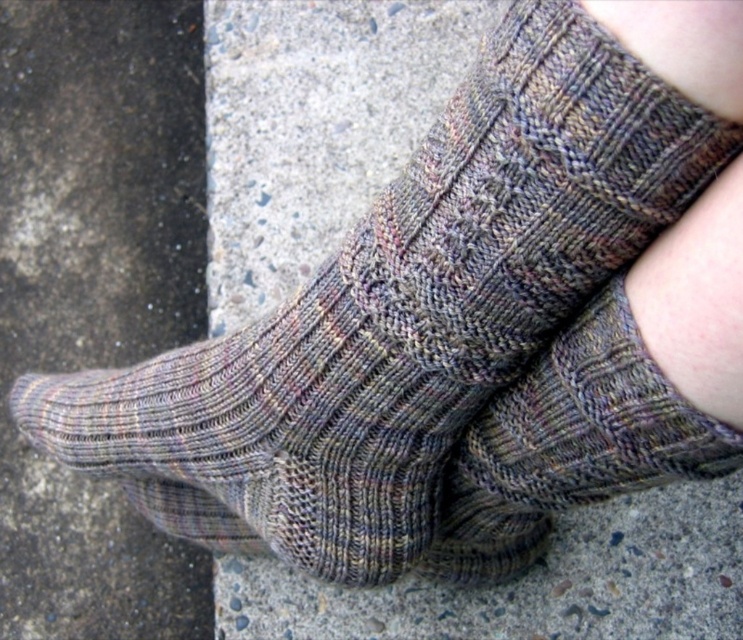
Question: Is gray concrete at lower left above multicolored knitted sock at center?

Choices:
 (A) yes
 (B) no

Answer: (A)

Question: Observing the image, what is the correct spatial positioning of gray concrete at lower left in reference to multicolored knitted sock at center?

Choices:
 (A) above
 (B) below

Answer: (A)

Question: Which of the following is the closest to the observer?

Choices:
 (A) gray concrete at lower left
 (B) multicolored knitted sock at center

Answer: (B)

Question: Which point appears closest to the camera in this image?

Choices:
 (A) (594, 472)
 (B) (13, 362)

Answer: (A)

Question: Does gray concrete at lower left come behind multicolored knitted sock at center?

Choices:
 (A) yes
 (B) no

Answer: (A)